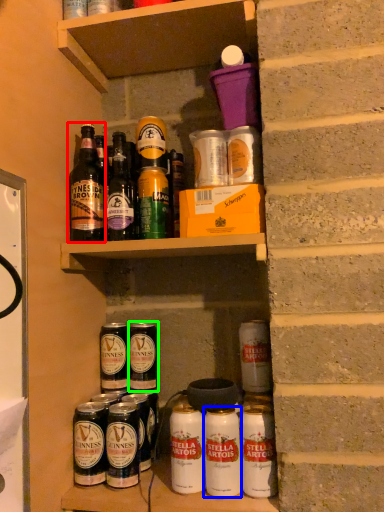
Question: Which object is positioned farthest from bottle (highlighted by a red box)? Select from yoghurt (highlighted by a blue box) and beer (highlighted by a green box).

Choices:
 (A) yoghurt
 (B) beer

Answer: (A)